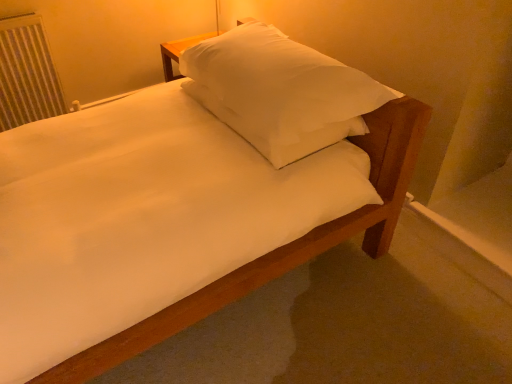
Locate an element on the screen. vacant space situated above white painted metal radiator at left (from a real-world perspective) is located at coordinates (16, 17).